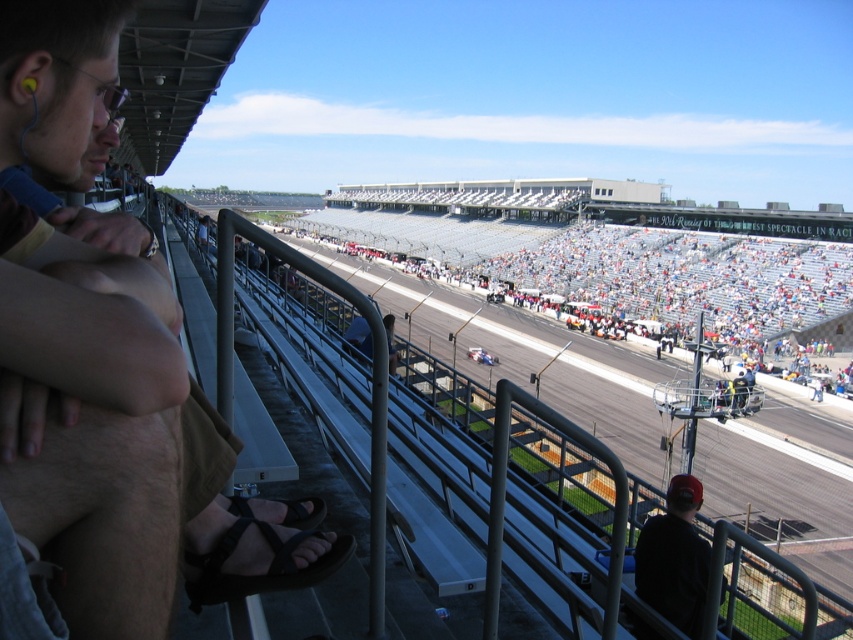
Question: Considering the relative positions of black fabric cap at lower right and black rubber sandal at lower center in the image provided, where is black fabric cap at lower right located with respect to black rubber sandal at lower center?

Choices:
 (A) above
 (B) below

Answer: (B)

Question: Which of the following is the farthest from the observer?

Choices:
 (A) (192, 564)
 (B) (296, 312)
 (C) (670, 298)
 (D) (308, 525)

Answer: (C)

Question: Which point appears closest to the camera in this image?

Choices:
 (A) (485, 228)
 (B) (293, 508)
 (C) (234, 500)

Answer: (C)

Question: Does black fabric cap at lower right appear over black synthetic sandal at lower left?

Choices:
 (A) yes
 (B) no

Answer: (B)

Question: Which object is closer to the camera taking this photo?

Choices:
 (A) smooth asphalt race track at center
 (B) matte black sandal at lower left
 (C) black fabric cap at lower right

Answer: (B)

Question: Does matte black sandal at lower left appear on the right side of black synthetic sandal at lower left?

Choices:
 (A) no
 (B) yes

Answer: (A)